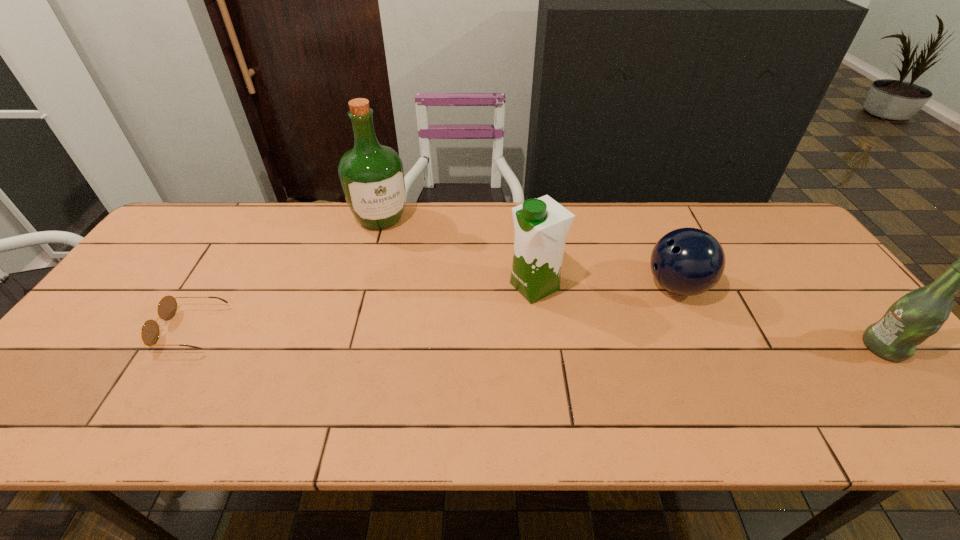
The image size is (960, 540). What are the coordinates of `vacant space situated on the surface of the second object from right to left near the finger holes` in the screenshot? It's located at (636, 306).

Identify the location of free space located 0.080m on the surface of the second object from right to left near the finger holes. This screenshot has height=540, width=960. (631, 309).

Locate an element on the screen. The height and width of the screenshot is (540, 960). free region located on the surface of the second object from right to left near the finger holes is located at coordinates (544, 353).

Identify the location of blank area located 0.310m on the front-facing side of the third object from left to right. This screenshot has width=960, height=540. (408, 347).

Identify the location of vacant point located 0.090m on the front-facing side of the third object from left to right. The image size is (960, 540). (485, 310).

At what (x,y) coordinates should I click in order to perform the action: click on free space located 0.310m on the front-facing side of the third object from left to right. Please return your answer as a coordinate pair (x, y). This screenshot has height=540, width=960. Looking at the image, I should click on (408, 347).

Identify the location of free space located 0.280m on the front-facing side of the tallest object. (420, 294).

This screenshot has width=960, height=540. Find the location of `vacant position located 0.330m on the front-facing side of the tallest object`. vacant position located 0.330m on the front-facing side of the tallest object is located at coordinates (425, 307).

What are the coordinates of `free location located 0.080m on the front-facing side of the tallest object` in the screenshot? It's located at (397, 251).

Find the location of a particular element. This screenshot has width=960, height=540. object present at the far edge is located at coordinates (372, 177).